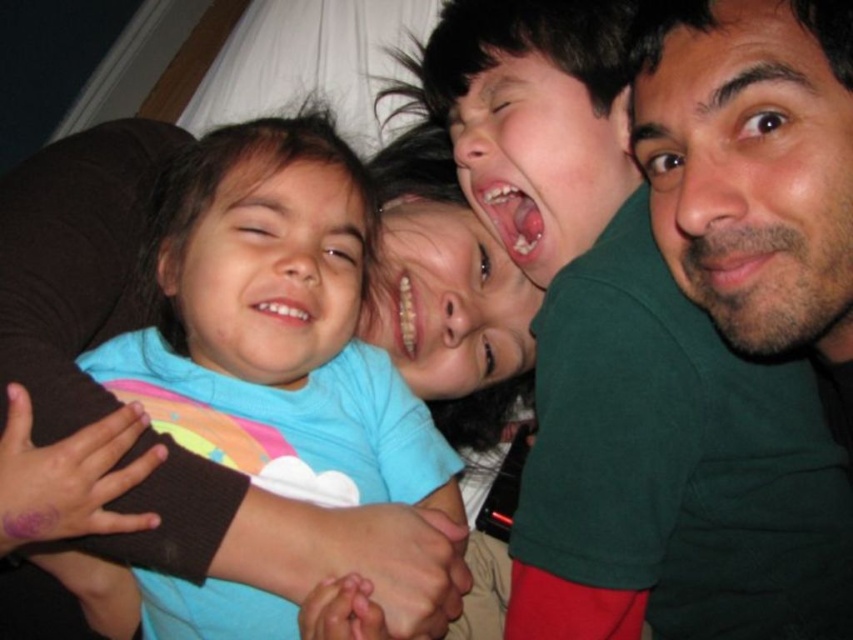
Which is above, blue cotton shirt at left or smooth pink lips at center?

smooth pink lips at center is higher up.

You are a GUI agent. You are given a task and a screenshot of the screen. Output one action in this format:
    pyautogui.click(x=<x>, y=<y>)
    Task: Click on the blue cotton shirt at left
    The width and height of the screenshot is (853, 640).
    Given the screenshot: What is the action you would take?
    pyautogui.click(x=276, y=323)

Is point (91, 371) positioned before point (506, 212)?

Yes, point (91, 371) is in front of point (506, 212).

This screenshot has width=853, height=640. What are the coordinates of `blue cotton shirt at left` in the screenshot? It's located at (276, 323).

Does green matte face at upper right have a smaller size compared to smooth pink lips at center?

Incorrect, green matte face at upper right is not smaller in size than smooth pink lips at center.

Does green matte face at upper right appear under smooth pink lips at center?

Yes, green matte face at upper right is below smooth pink lips at center.

Does point (782, 154) come behind point (491, 227)?

No.

Where is `green matte face at upper right`? green matte face at upper right is located at coordinates (752, 163).

Can you confirm if blue cotton shirt at left is bigger than green matte face at upper right?

Yes, blue cotton shirt at left is bigger than green matte face at upper right.

Which is more to the left, blue cotton shirt at left or green matte face at upper right?

blue cotton shirt at left is more to the left.

Is point (279, 456) farther from camera compared to point (804, 276)?

Yes, point (279, 456) is behind point (804, 276).

The image size is (853, 640). In order to click on blue cotton shirt at left in this screenshot , I will do `click(276, 323)`.